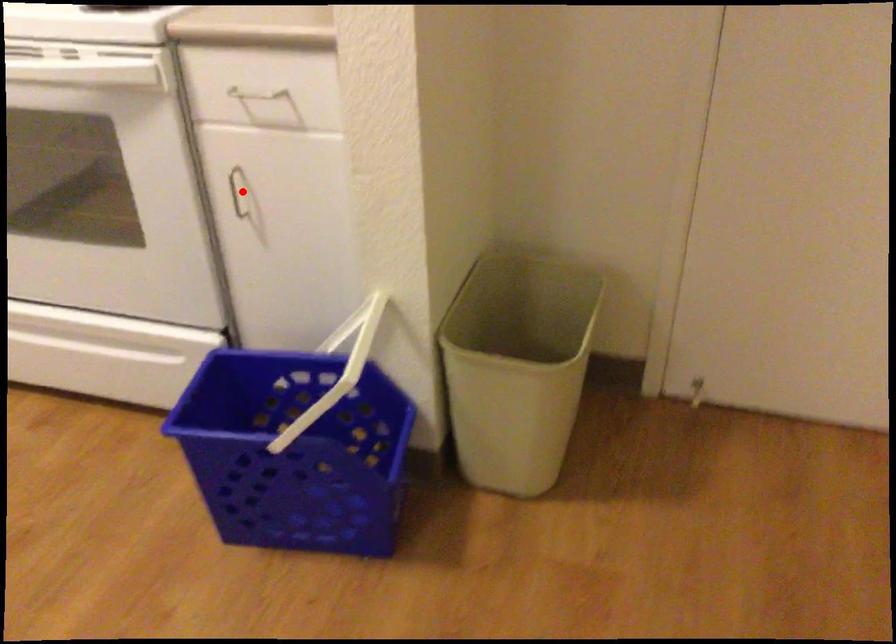
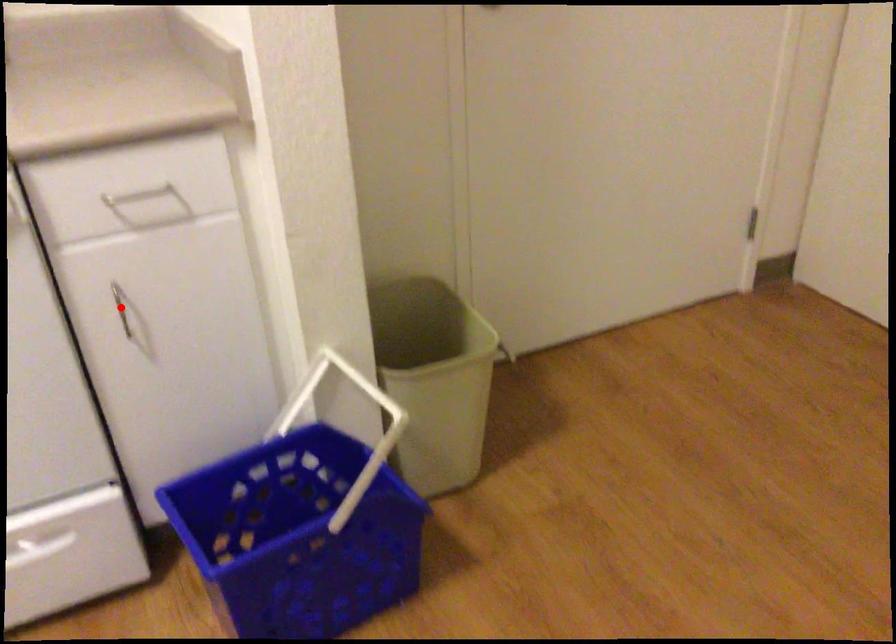
I am providing you with two images of the same scene from different viewpoints. A red point is marked on the first image and another point is marked on the second image. Are the points marked in image1 and image2 representing the same 3D position?

Yes